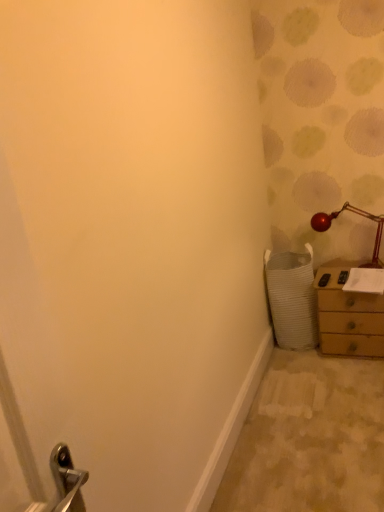
Where is `metallic red lamp at upper right`? This screenshot has height=512, width=384. metallic red lamp at upper right is located at coordinates [357, 214].

What do you see at coordinates (357, 214) in the screenshot? I see `metallic red lamp at upper right` at bounding box center [357, 214].

Locate an element on the screen. wooden chest of drawers at right is located at coordinates (347, 314).

This screenshot has width=384, height=512. What do you see at coordinates (347, 314) in the screenshot?
I see `wooden chest of drawers at right` at bounding box center [347, 314].

Locate an element on the screen. This screenshot has height=512, width=384. metallic red lamp at upper right is located at coordinates (357, 214).

Visually, is wooden chest of drawers at right positioned to the left or to the right of metallic red lamp at upper right?

Based on their positions, wooden chest of drawers at right is located to the right of metallic red lamp at upper right.

Which is behind, wooden chest of drawers at right or metallic red lamp at upper right?

metallic red lamp at upper right is behind.

Is point (379, 343) farther from camera compared to point (357, 211)?

No.

From the image's perspective, who appears lower, wooden chest of drawers at right or metallic red lamp at upper right?

wooden chest of drawers at right is shown below in the image.

From a real-world perspective, which is physically above, wooden chest of drawers at right or metallic red lamp at upper right?

metallic red lamp at upper right.

Which of these two, wooden chest of drawers at right or metallic red lamp at upper right, is thinner?

metallic red lamp at upper right is thinner.

Between wooden chest of drawers at right and metallic red lamp at upper right, which one has less height?

metallic red lamp at upper right.

Based on their sizes in the image, would you say wooden chest of drawers at right is bigger or smaller than metallic red lamp at upper right?

Considering their sizes, wooden chest of drawers at right takes up more space than metallic red lamp at upper right.

Is metallic red lamp at upper right surrounded by wooden chest of drawers at right?

Definitely not — metallic red lamp at upper right is not inside wooden chest of drawers at right.

Are wooden chest of drawers at right and metallic red lamp at upper right located far from each other?

No, wooden chest of drawers at right is in close proximity to metallic red lamp at upper right.

Is wooden chest of drawers at right oriented towards metallic red lamp at upper right?

No, wooden chest of drawers at right does not turn towards metallic red lamp at upper right.

This screenshot has height=512, width=384. I want to click on chest of drawers that is on the right side of metallic red lamp at upper right, so click(x=347, y=314).

In the image, is metallic red lamp at upper right on the left side or the right side of wooden chest of drawers at right?

Based on their positions, metallic red lamp at upper right is located to the left of wooden chest of drawers at right.

Which is in front, metallic red lamp at upper right or wooden chest of drawers at right?

Positioned in front is wooden chest of drawers at right.

Which is in front, point (327, 227) or point (357, 346)?

The point (357, 346) is closer.

From the image's perspective, is metallic red lamp at upper right located above or below wooden chest of drawers at right?

Clearly, from the image's perspective, metallic red lamp at upper right is above wooden chest of drawers at right.

From a real-world perspective, which object stands above the other?

In real-world perspective, metallic red lamp at upper right is above.

Considering the sizes of objects metallic red lamp at upper right and wooden chest of drawers at right in the image provided, who is thinner, metallic red lamp at upper right or wooden chest of drawers at right?

With smaller width is metallic red lamp at upper right.

Considering the sizes of metallic red lamp at upper right and wooden chest of drawers at right in the image, is metallic red lamp at upper right taller or shorter than wooden chest of drawers at right?

In the image, metallic red lamp at upper right appears to be shorter than wooden chest of drawers at right.

Who is bigger, metallic red lamp at upper right or wooden chest of drawers at right?

wooden chest of drawers at right is bigger.

Can we say metallic red lamp at upper right lies outside wooden chest of drawers at right?

Yes, metallic red lamp at upper right is outside of wooden chest of drawers at right.

Is metallic red lamp at upper right next to wooden chest of drawers at right and touching it?

No, metallic red lamp at upper right is not making contact with wooden chest of drawers at right.

Is metallic red lamp at upper right oriented towards wooden chest of drawers at right?

No, metallic red lamp at upper right is not turned towards wooden chest of drawers at right.

The height and width of the screenshot is (512, 384). I want to click on lamp above the wooden chest of drawers at right (from a real-world perspective), so click(x=357, y=214).

Identify the location of chest of drawers located on the right of metallic red lamp at upper right. (347, 314).

Identify the location of lamp above the wooden chest of drawers at right (from a real-world perspective). Image resolution: width=384 pixels, height=512 pixels. (357, 214).